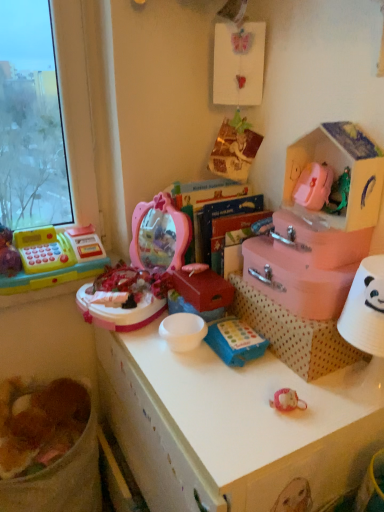
The height and width of the screenshot is (512, 384). In order to click on free space in front of blue fabric toy at center, the second toy from the back in this screenshot , I will do `click(236, 397)`.